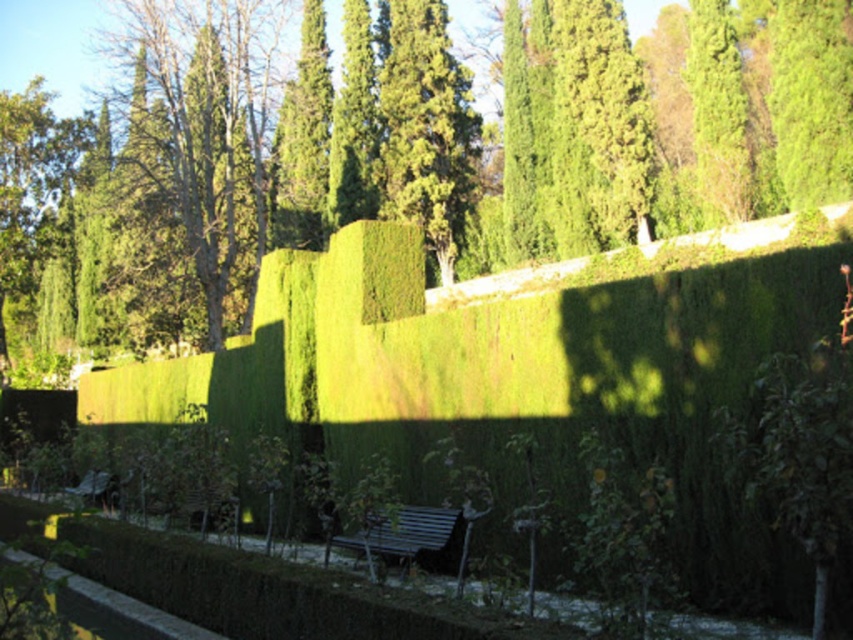
Between green leafy tree at center and metallic blue bench at center, which one appears on the left side from the viewer's perspective?

Positioned to the left is metallic blue bench at center.

Is green leafy tree at center positioned in front of metallic blue bench at center?

No, green leafy tree at center is behind metallic blue bench at center.

Is point (393, 35) positioned before point (335, 545)?

No, (393, 35) is behind (335, 545).

Image resolution: width=853 pixels, height=640 pixels. Find the location of `green leafy tree at center`. green leafy tree at center is located at coordinates (426, 128).

Is metallic blue bench at center in front of wooden park bench at lower left?

Yes, it is.

Is point (367, 531) farther from camera compared to point (102, 493)?

That is False.

Find the location of a particular element. metallic blue bench at center is located at coordinates (402, 534).

Which of these two, green leafy tree at center or wooden park bench at lower left, stands taller?

green leafy tree at center

Which is more to the left, green leafy tree at center or wooden park bench at lower left?

Result: wooden park bench at lower left is more to the left.

Who is more distant from viewer, (444,209) or (99,496)?

The point (444,209) is behind.

Find the location of a particular element. This screenshot has width=853, height=640. green leafy tree at center is located at coordinates (426, 128).